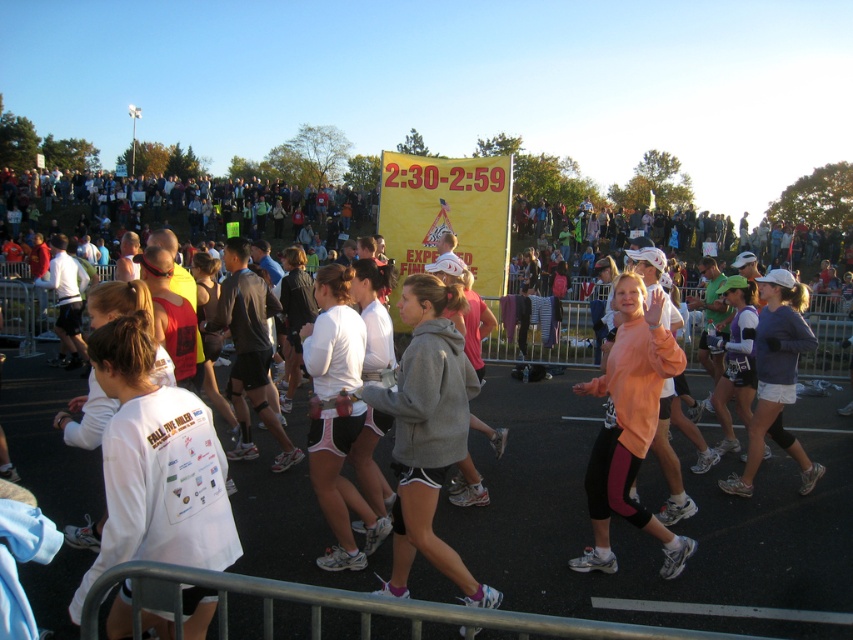
You are a photographer at the running event. You want to take a photo of the runners wearing the white matte shirt at center and the gray fleece sweatshirt at center. Which runner is positioned higher in the frame?

The white matte shirt at center is located above the gray fleece sweatshirt at center, so the runner wearing the white matte shirt at center is positioned higher in the frame.

You are a photographer positioned at the starting line of the running event. You want to capture a photo that includes both the white matte shirt at center and the pink matte leggings at center. What is the minimum distance you need to move backward to ensure both are in frame?

The white matte shirt at center and pink matte leggings at center are 9.33 feet apart from each other. To capture both in the frame, you would need to move backward until your camera can encompass a distance of at least 9.33 feet between them. The exact distance to move depends on your camera lens and sensor size, but ensuring the frame width accommodates their separation is essential.